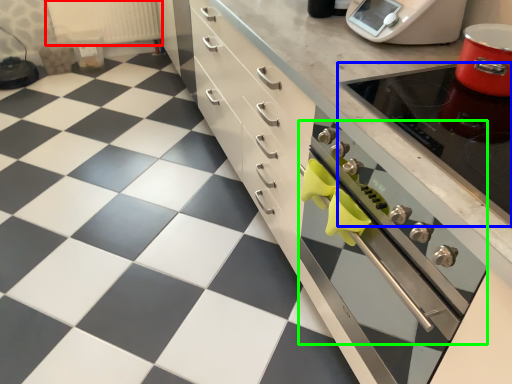
Question: Which object is positioned closest to radiator (highlighted by a red box)? Select from appliance (highlighted by a blue box) and oven (highlighted by a green box).

Choices:
 (A) appliance
 (B) oven

Answer: (B)